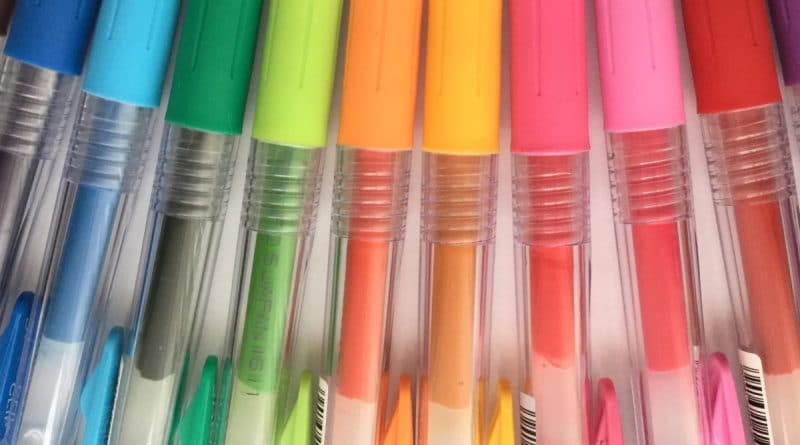
Find the location of a particular element. The height and width of the screenshot is (445, 800). pen clips is located at coordinates (718, 385), (600, 407), (505, 405), (402, 412), (301, 412), (205, 397), (102, 377), (12, 326).